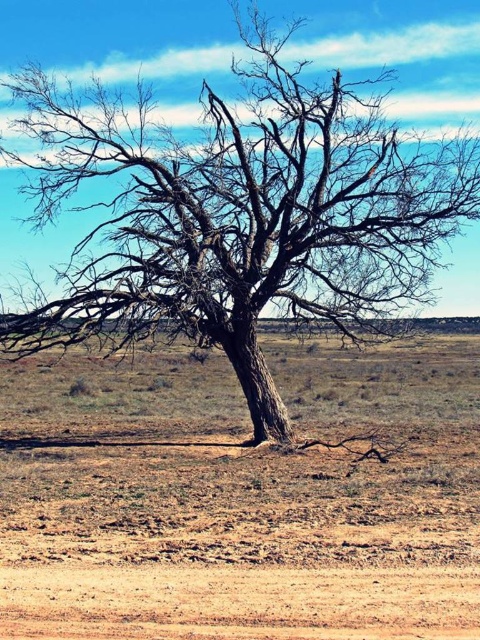
Is brown sandy soil at center above dark brown bark tree at center?

Incorrect, brown sandy soil at center is not positioned above dark brown bark tree at center.

Is point (134, 586) behind point (224, 337)?

No, (134, 586) is in front of (224, 337).

The image size is (480, 640). In order to click on brown sandy soil at center in this screenshot , I will do pos(240,497).